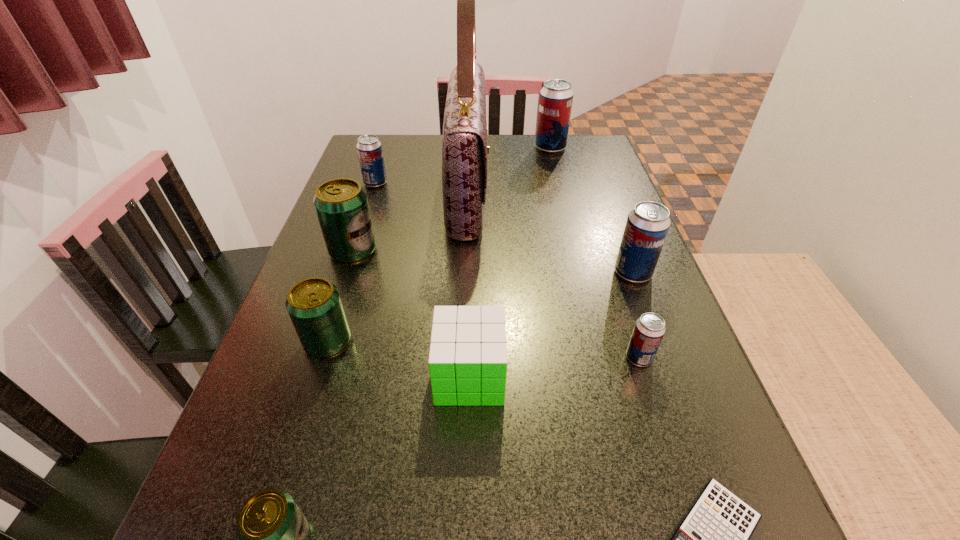
The image size is (960, 540). What are the coordinates of `the tallest object` in the screenshot? It's located at (464, 144).

Identify the location of brown handbag. (464, 144).

Identify the location of the ninth shortest object. (556, 97).

At what (x,y) coordinates should I click in order to perform the action: click on the farthest beer can. Please return your answer as a coordinate pair (x, y). Looking at the image, I should click on (556, 97).

Identify the location of the third farthest red beer can. The width and height of the screenshot is (960, 540). (647, 225).

Identify the location of the biggest green beer can. (341, 204).

This screenshot has width=960, height=540. What are the coordinates of `the second farthest red beer can` in the screenshot? It's located at (369, 148).

Where is `the leftmost red beer can`? This screenshot has height=540, width=960. the leftmost red beer can is located at coordinates (369, 148).

The image size is (960, 540). Find the location of `the second farthest green beer can`. the second farthest green beer can is located at coordinates (314, 305).

At what (x,y) coordinates should I click in order to perform the action: click on cube. Please return your answer as a coordinate pair (x, y). The width and height of the screenshot is (960, 540). Looking at the image, I should click on (467, 362).